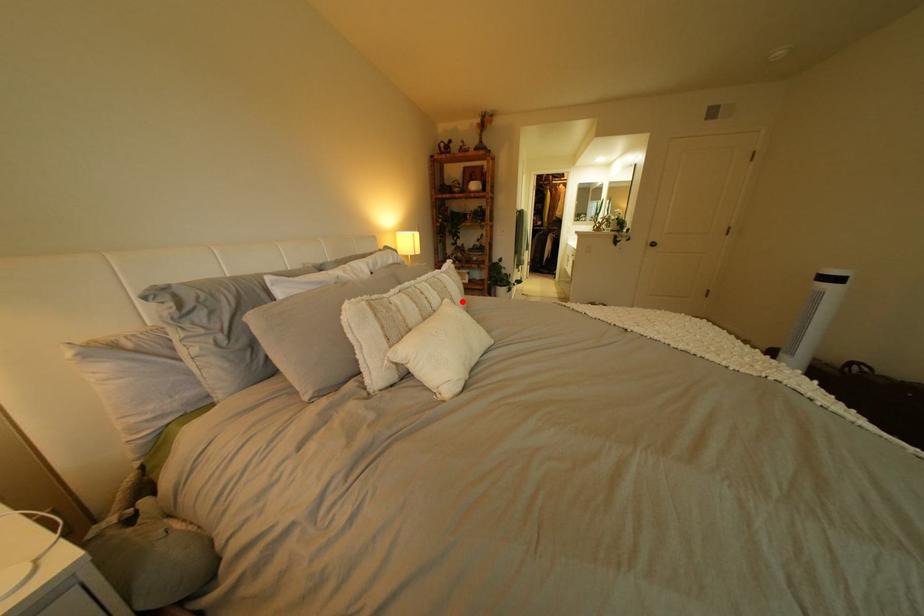
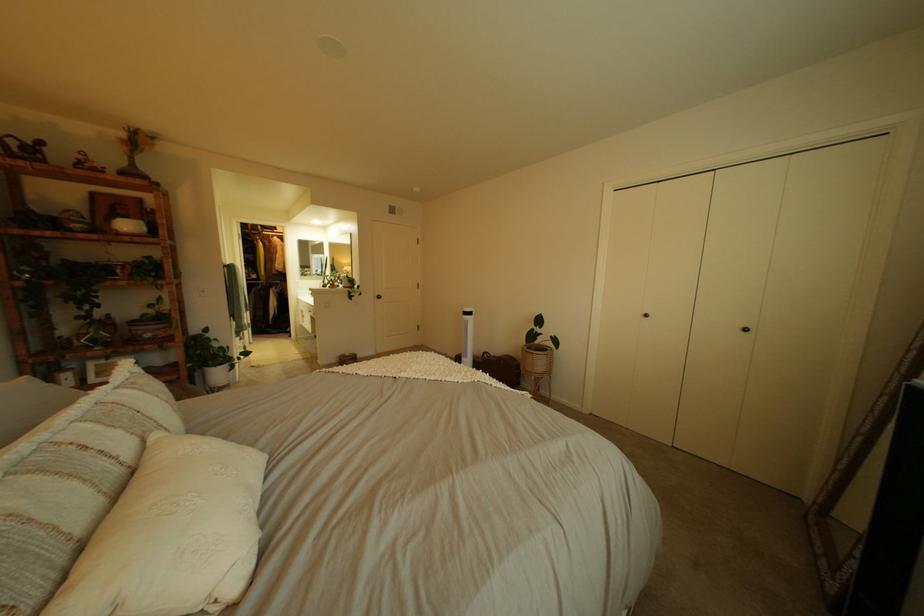
Locate, in the second image, the point that corresponds to the highlighted location in the first image.

(172, 436)